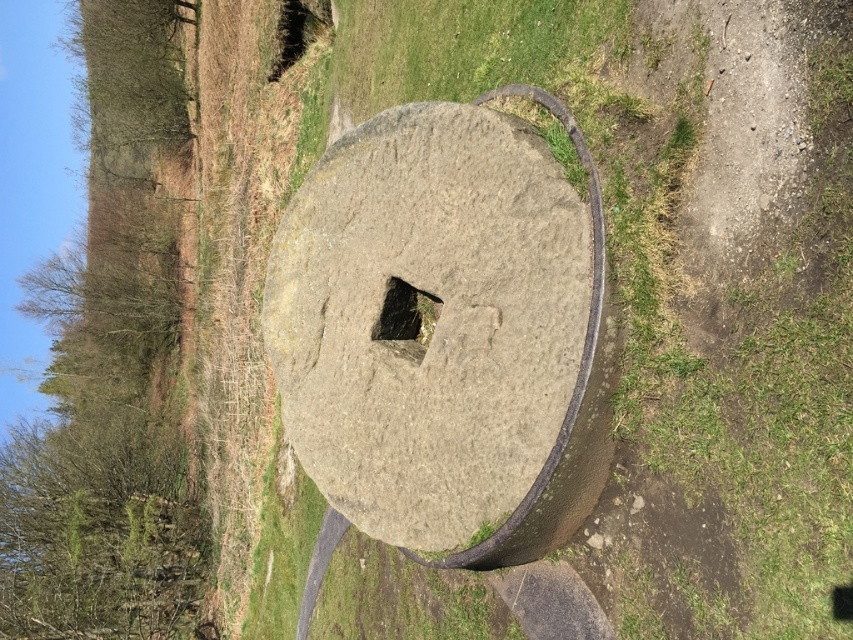
Question: Is green mossy stone at center in front of dark brown stone hole at upper center?

Choices:
 (A) yes
 (B) no

Answer: (A)

Question: Which object is positioned farthest from the green mossy stone at center?

Choices:
 (A) gray stone at center
 (B) dark brown stone hole at upper center

Answer: (B)

Question: Which object is closer to the camera taking this photo?

Choices:
 (A) gray stone at center
 (B) dark brown stone hole at upper center
 (C) green mossy stone at center

Answer: (A)

Question: Can you confirm if gray stone at center is positioned above dark brown stone hole at upper center?

Choices:
 (A) yes
 (B) no

Answer: (B)

Question: Which object is closer to the camera taking this photo?

Choices:
 (A) gray stone at center
 (B) green mossy stone at center

Answer: (A)

Question: Is green mossy stone at center above dark brown stone hole at upper center?

Choices:
 (A) yes
 (B) no

Answer: (B)